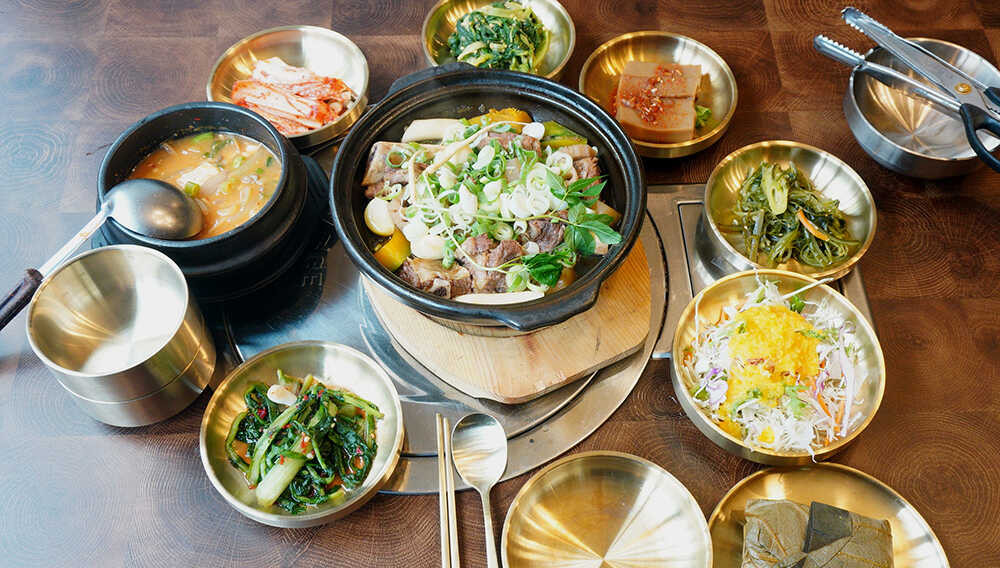
This screenshot has height=568, width=1000. I want to click on chopstick, so click(x=450, y=474), click(x=443, y=474).